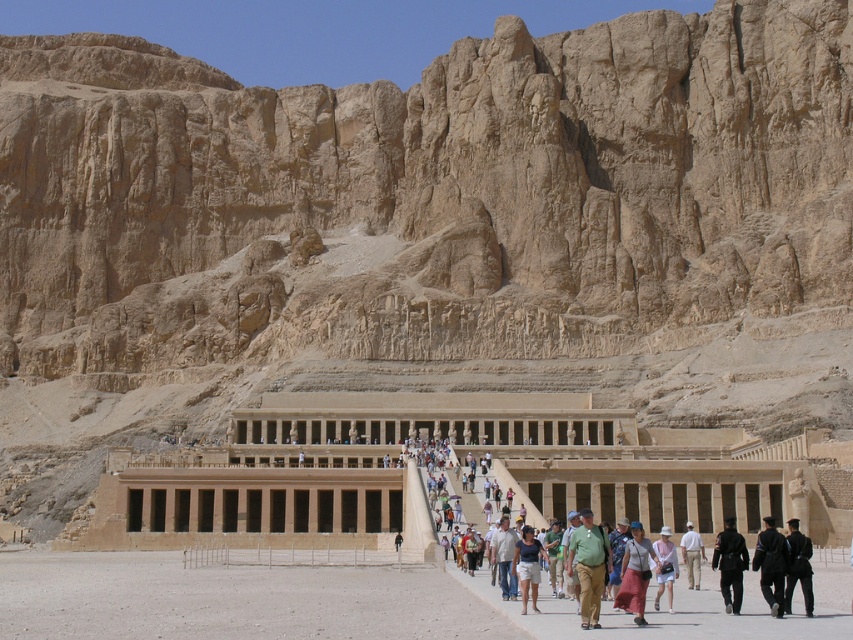
Is point (593, 588) in front of point (766, 552)?

That is True.

Between point (596, 595) and point (776, 579), which one is positioned behind?

Positioned behind is point (776, 579).

Who is more distant from viewer, (x=585, y=600) or (x=764, y=566)?

Point (x=764, y=566)

This screenshot has width=853, height=640. I want to click on green fabric shirt at center, so click(589, 566).

Does dark blue fabric jacket at lower right have a lesser width compared to white cotton dress at center?

No, dark blue fabric jacket at lower right is not thinner than white cotton dress at center.

Is point (769, 564) closer to viewer compared to point (662, 552)?

Yes.

Find the location of a particular element. dark blue fabric jacket at lower right is located at coordinates (770, 564).

Who is more forward, (799,541) or (683,557)?

Point (799,541)

Who is more distant from viewer, (810, 595) or (693, 579)?

The point (693, 579) is more distant.

Is point (787, 573) closer to viewer compared to point (689, 563)?

Yes.

Where is `dark blue uniform at center`? The image size is (853, 640). dark blue uniform at center is located at coordinates (798, 566).